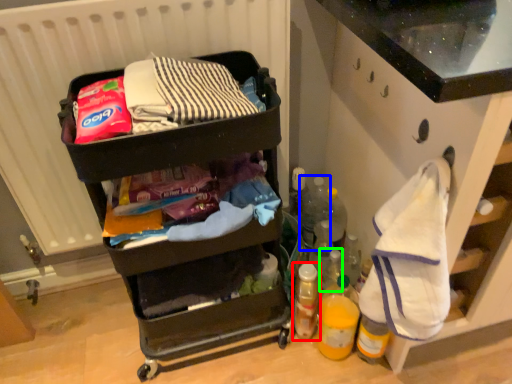
Question: Estimate the real-world distances between objects in this image. Which object is farther from bottle (highlighted by a red box), bottle (highlighted by a blue box) or bottle (highlighted by a green box)?

Choices:
 (A) bottle
 (B) bottle

Answer: (A)